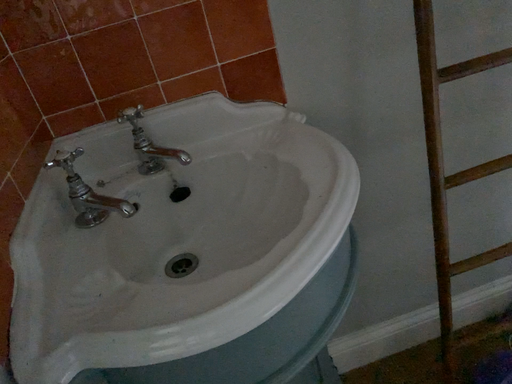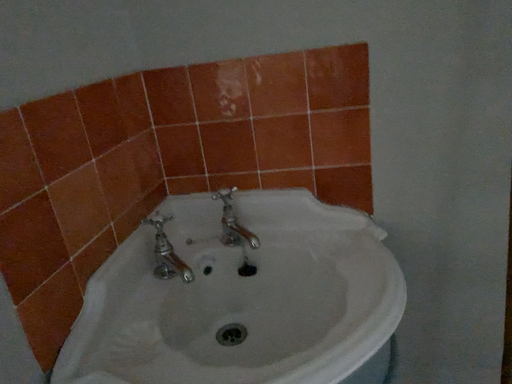
Question: Which way did the camera rotate in the video?

Choices:
 (A) rotated left
 (B) rotated right

Answer: (A)